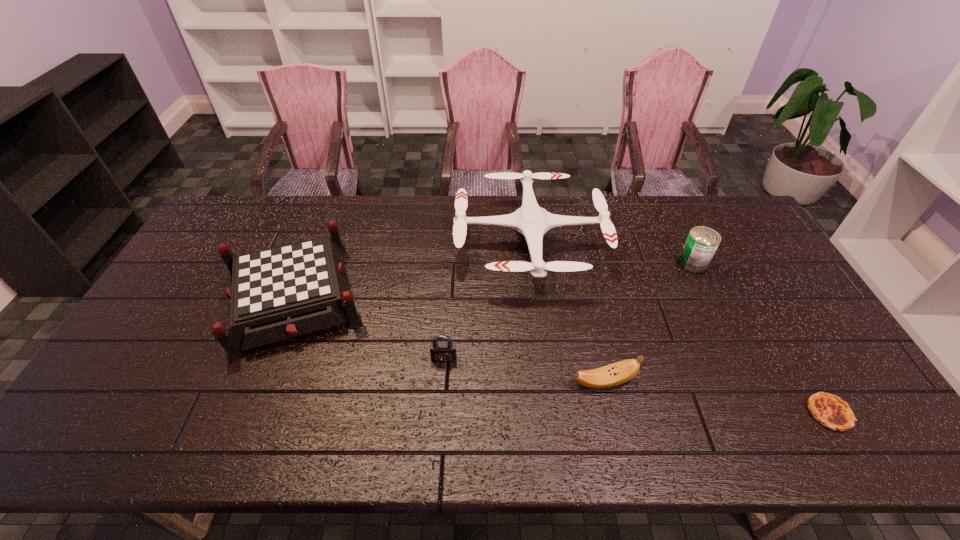
Image resolution: width=960 pixels, height=540 pixels. I want to click on drone, so click(531, 221).

The height and width of the screenshot is (540, 960). What are the coordinates of `checkerboard` in the screenshot? It's located at (278, 293).

Locate an element on the screen. Image resolution: width=960 pixels, height=540 pixels. the fifth object from left to right is located at coordinates (702, 242).

This screenshot has width=960, height=540. I want to click on the fifth farthest object, so click(x=614, y=374).

Image resolution: width=960 pixels, height=540 pixels. Find the location of `padlock`. padlock is located at coordinates coord(442,351).

You are a GUI agent. You are given a task and a screenshot of the screen. Output one action in this format:
    pyautogui.click(x=<x>, y=<y>)
    Task: Click on the rightmost object
    
    Given the screenshot: What is the action you would take?
    pyautogui.click(x=829, y=410)

Locate an element on the screen. the shortest object is located at coordinates (829, 410).

Locate an element on the screen. The height and width of the screenshot is (540, 960). free spot located 0.340m with the camera attached at the bottom of the drone is located at coordinates (353, 243).

Find the location of a particular element. vacant area located with the camera attached at the bottom of the drone is located at coordinates (386, 243).

Where is `free space located with the camera attached at the bottom of the drone`? free space located with the camera attached at the bottom of the drone is located at coordinates (422, 243).